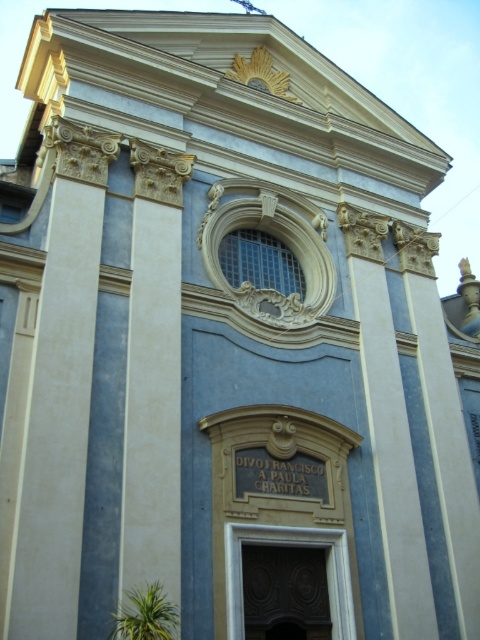
You are standing in front of the classical building and want to take a photo of the white plaster column at left. If your camera has a maximum focus range of 30 meters, will you be able to capture the column clearly?

The white plaster column at left is 30.20 meters away from the camera. Since the maximum focus range is 30 meters, the camera cannot focus on the column clearly at that distance.

You are an architect examining the building facade. You need to determine the order in which you would see the white plaster column at left and the dark wood carved door at center from your current viewpoint. Which object appears first in your line of sight?

The white plaster column at left appears first in your line of sight because it is closer to the viewer than the dark wood carved door at center.

You are standing in front of the classical building and want to enter through the dark wood carved door at center. Which side of the white plaster column at left should you walk around to reach the door?

You should walk around the right side of the white plaster column at left to reach the dark wood carved door at center, as the column is positioned to the left of the door.